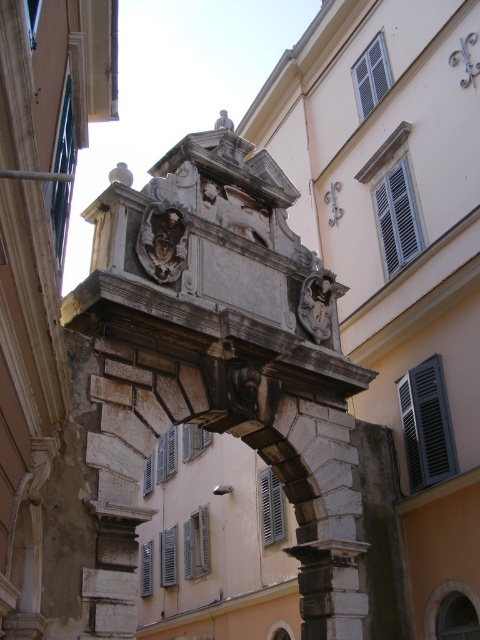
Question: Is stone relief sculpture at center wider than dark gray stone sculpture at upper center?

Choices:
 (A) no
 (B) yes

Answer: (A)

Question: Among these objects, which one is nearest to the camera?

Choices:
 (A) stone relief sculpture at center
 (B) white stone sculpture at upper center
 (C) dark gray stone sculpture at upper center

Answer: (B)

Question: Estimate the real-world distances between objects in this image. Which object is closer to the dark gray stone sculpture at upper center?

Choices:
 (A) white stone sculpture at upper center
 (B) stone relief sculpture at center

Answer: (B)

Question: Which point appears farthest from the camera in this image?

Choices:
 (A) (312, 321)
 (B) (158, 243)
 (C) (229, 122)
 (D) (120, 161)

Answer: (D)

Question: Does carved stone mask at center lie behind white stone sculpture at upper center?

Choices:
 (A) yes
 (B) no

Answer: (B)

Question: Is stone relief sculpture at center further to the viewer compared to dark gray stone sculpture at upper center?

Choices:
 (A) yes
 (B) no

Answer: (B)